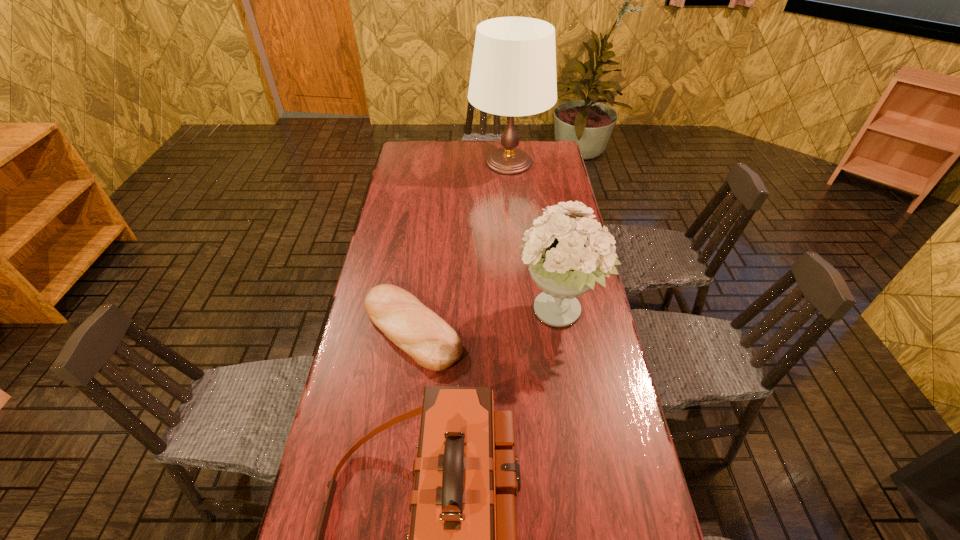
Locate an element on the screen. bouquet present at the right edge is located at coordinates (567, 255).

Where is `object at the far right corner`? object at the far right corner is located at coordinates (513, 73).

Locate an element on the screen. The height and width of the screenshot is (540, 960). free space at the far edge is located at coordinates (483, 147).

This screenshot has width=960, height=540. In the image, there is a desktop. Identify the location of vacant space at the left edge. pyautogui.click(x=391, y=278).

The height and width of the screenshot is (540, 960). I want to click on vacant area at the right edge of the desktop, so click(583, 447).

The image size is (960, 540). In order to click on vacant space at the far right corner of the desktop in this screenshot , I will do `click(558, 152)`.

Where is `vacant area that lies between the tallest object and the shortest object`? The image size is (960, 540). vacant area that lies between the tallest object and the shortest object is located at coordinates (461, 246).

Locate an element on the screen. The height and width of the screenshot is (540, 960). unoccupied position between the bouquet and the shortest object is located at coordinates (485, 321).

Locate an element on the screen. The width and height of the screenshot is (960, 540). unoccupied area between the bouquet and the shortest object is located at coordinates (485, 321).

Select which object appears as the third closest to the second shortest object. Please provide its 2D coordinates. Your answer should be formatted as a tuple, i.e. [(x, y)], where the tuple contains the x and y coordinates of a point satisfying the conditions above.

[(513, 73)]